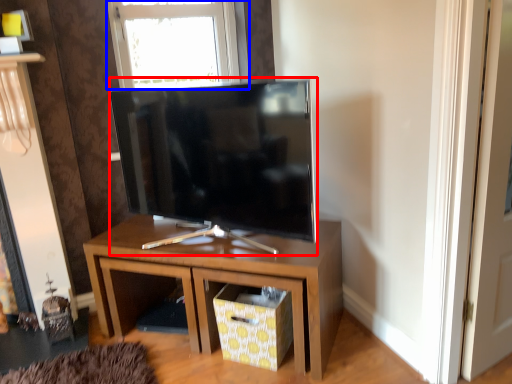
Question: Which of the following is the farthest to the observer, television (highlighted by a red box) or window (highlighted by a blue box)?

Choices:
 (A) television
 (B) window

Answer: (B)